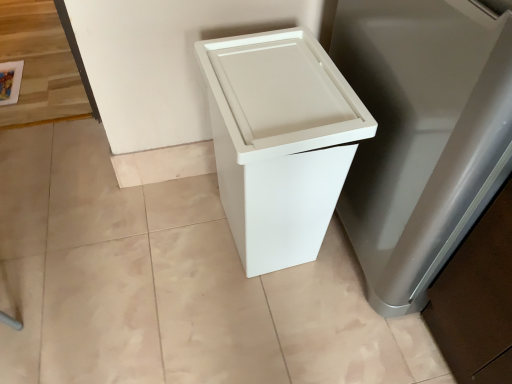
Question: Looking at the image, does white plastic trash can at lower right seem bigger or smaller compared to white matte trash can at center?

Choices:
 (A) big
 (B) small

Answer: (A)

Question: From the image's perspective, is white plastic trash can at lower right located above or below white matte trash can at center?

Choices:
 (A) above
 (B) below

Answer: (A)

Question: Looking at their shapes, would you say white plastic trash can at lower right is wider or thinner than white matte trash can at center?

Choices:
 (A) wide
 (B) thin

Answer: (A)

Question: Is white matte trash can at center bigger or smaller than white plastic trash can at lower right?

Choices:
 (A) big
 (B) small

Answer: (B)

Question: Considering the positions of point (287, 48) and point (425, 188), is point (287, 48) closer or farther from the camera than point (425, 188)?

Choices:
 (A) farther
 (B) closer

Answer: (A)

Question: Is white matte trash can at center taller or shorter than white plastic trash can at lower right?

Choices:
 (A) short
 (B) tall

Answer: (A)

Question: Considering the positions of white matte trash can at center and white plastic trash can at lower right in the image, is white matte trash can at center wider or thinner than white plastic trash can at lower right?

Choices:
 (A) thin
 (B) wide

Answer: (A)